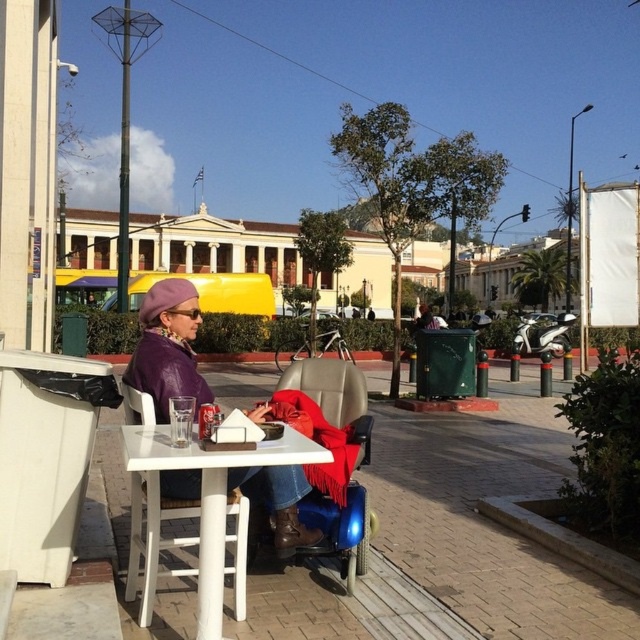
You are a delivery person who needs to place a package on the table. The package is 1 meter long. Can you place it on the white plastic table at center without moving the purple leather jacket at center?

The white plastic table at center is behind the purple leather jacket at center, so the package cannot be placed on the table without moving the jacket because the jacket is blocking the table.

You are a tourist in the city and want to take a photo of the purple leather jacket at center. Where exactly should you position yourself to capture it in the frame?

To capture the purple leather jacket at center in your photo, position yourself at point 0.544 on the x axis and 0.263 on the y axis.

You are a delivery robot navigating through the urban scene. There is a point marked at coordinates (x=168, y=348). What object is located at that point?

The point at coordinates (x=168, y=348) marks the purple leather jacket at center.